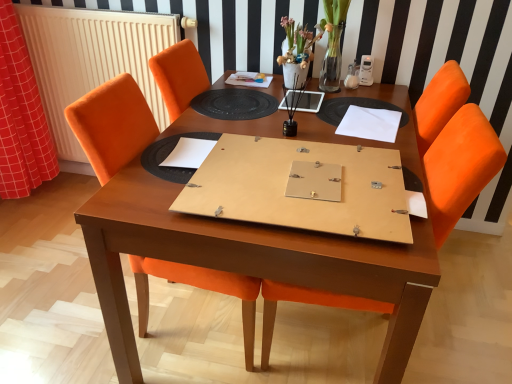
The height and width of the screenshot is (384, 512). In order to click on vacant area to the left of orange fabric chair at center, the 1th chair from the left in this screenshot , I will do `click(63, 317)`.